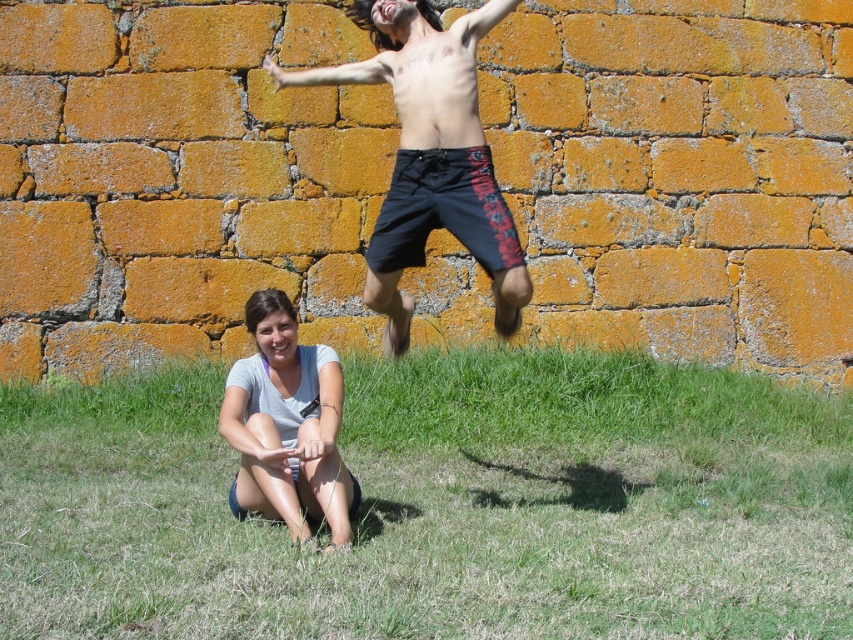
You are a photographer trying to capture the scene. You want to ensure that both the dark blue shorts at upper center and the gray cotton shirt at lower left are visible in the frame. Based on their positions, which object might partially block the view of the other?

The gray cotton shirt at lower left is behind dark blue shorts at upper center, so the dark blue shorts at upper center might partially block the view of the gray cotton shirt at lower left.

You are a photographer trying to capture the scene with the green grass at lower center and the gray cotton shirt at lower left. Based on their positions, which object should appear closer to the camera in the photo?

The green grass at lower center should appear closer to the camera because it is in front of the gray cotton shirt at lower left.

You are standing in the scene and want to sit down on the green grass at lower center. Which direction should you move relative to the gray cotton shirt at lower left?

You should move to the right relative to the gray cotton shirt at lower left because the green grass at lower center is located to the left of the gray cotton shirt at lower left.